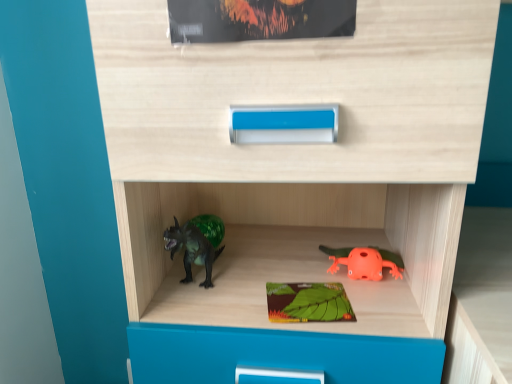
Question: Considering their positions, is green matte board game at center, which is counted as the 2th paperback book, starting from the top, located in front of or behind matte green paperback book at upper center, arranged as the 2th paperback book when ordered from the bottom?

Choices:
 (A) behind
 (B) front

Answer: (A)

Question: From the image's perspective, is green matte board game at center, positioned as the 1th paperback book in back-to-front order, positioned above or below matte green paperback book at upper center, arranged as the 2th paperback book when ordered from the bottom?

Choices:
 (A) above
 (B) below

Answer: (B)

Question: Estimate the real-world distances between objects in this image. Which object is farther from the matte green paperback book at upper center, arranged as the 2th paperback book when ordered from the bottom?

Choices:
 (A) green matte board game at center, positioned as the 1th paperback book in back-to-front order
 (B) orange matte frog at lower right

Answer: (B)

Question: Based on their relative distances, which object is nearer to the matte green paperback book at upper center, acting as the first paperback book starting from the top?

Choices:
 (A) orange matte frog at lower right
 (B) green matte board game at center, which ranks as the 1th paperback book in bottom-to-top order

Answer: (B)